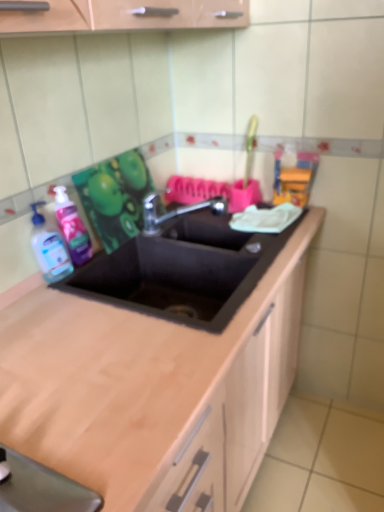
This screenshot has width=384, height=512. I want to click on vacant space to the right of metallic faucet at center, so click(x=248, y=240).